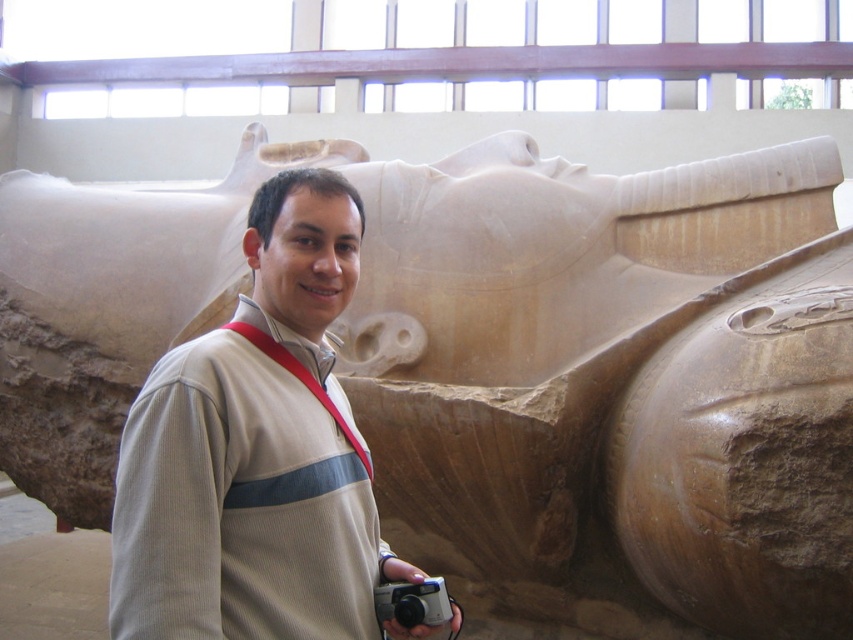
Question: Is beige corduroy sweater at center thinner than silver plastic camera at lower center?

Choices:
 (A) no
 (B) yes

Answer: (A)

Question: Does beige corduroy sweater at center have a larger size compared to silver plastic camera at lower center?

Choices:
 (A) yes
 (B) no

Answer: (A)

Question: Which of the following is the closest to the observer?

Choices:
 (A) (380, 588)
 (B) (303, 202)

Answer: (A)

Question: Which point is closer to the camera?

Choices:
 (A) click(x=254, y=346)
 (B) click(x=387, y=582)

Answer: (A)

Question: Can you confirm if beige corduroy sweater at center is bigger than silver plastic camera at lower center?

Choices:
 (A) no
 (B) yes

Answer: (B)